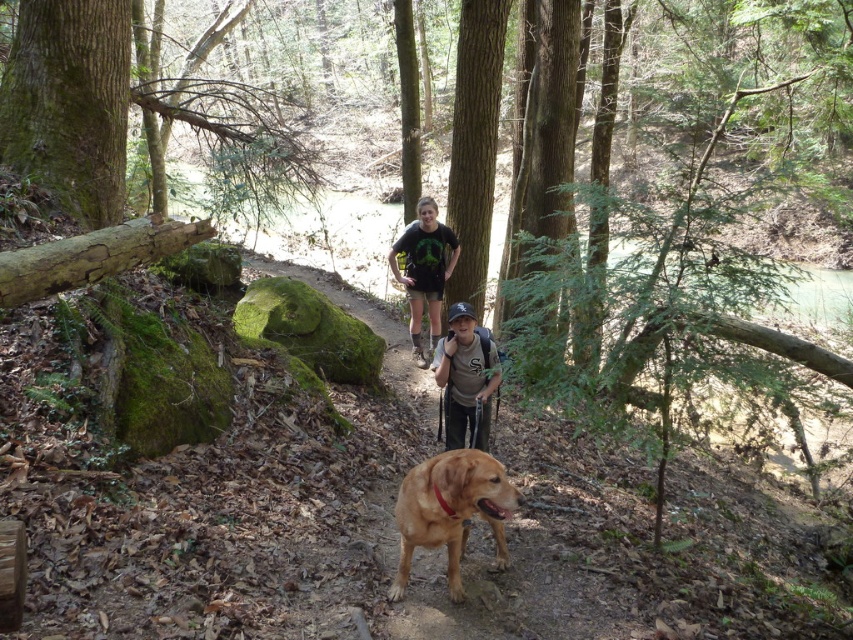
Question: Does golden fur dog at center appear on the right side of khaki cotton shirt at center?

Choices:
 (A) yes
 (B) no

Answer: (B)

Question: Can you confirm if golden fur dog at center is positioned above khaki cotton shirt at center?

Choices:
 (A) no
 (B) yes

Answer: (A)

Question: Can you confirm if khaki cotton shirt at center is smaller than matte black t-shirt at center?

Choices:
 (A) no
 (B) yes

Answer: (B)

Question: Which object appears closest to the camera in this image?

Choices:
 (A) matte black t-shirt at center
 (B) golden fur dog at center
 (C) khaki cotton shirt at center

Answer: (B)

Question: Which of the following is the farthest from the observer?

Choices:
 (A) (436, 516)
 (B) (473, 404)
 (C) (402, 282)

Answer: (C)

Question: Considering the real-world distances, which object is closest to the matte black t-shirt at center?

Choices:
 (A) khaki cotton shirt at center
 (B) golden fur dog at center

Answer: (A)